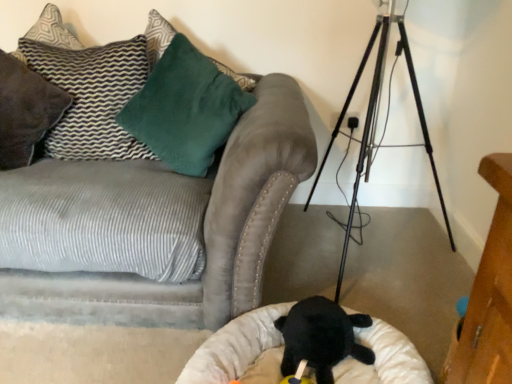
Question: Considering the relative sizes of metallic tripod at center and suede gray couch at upper left in the image provided, is metallic tripod at center wider than suede gray couch at upper left?

Choices:
 (A) yes
 (B) no

Answer: (B)

Question: Considering the relative positions of metallic tripod at center and suede gray couch at upper left in the image provided, is metallic tripod at center to the right of suede gray couch at upper left from the viewer's perspective?

Choices:
 (A) yes
 (B) no

Answer: (A)

Question: Is metallic tripod at center next to suede gray couch at upper left and touching it?

Choices:
 (A) no
 (B) yes

Answer: (A)

Question: Is metallic tripod at center oriented away from suede gray couch at upper left?

Choices:
 (A) no
 (B) yes

Answer: (A)

Question: Is metallic tripod at center far from suede gray couch at upper left?

Choices:
 (A) yes
 (B) no

Answer: (B)

Question: From a real-world perspective, does metallic tripod at center stand above suede gray couch at upper left?

Choices:
 (A) no
 (B) yes

Answer: (B)

Question: From a real-world perspective, is soft plush toy at center over black plush toy at lower center?

Choices:
 (A) yes
 (B) no

Answer: (B)

Question: Considering the relative positions of soft plush toy at center and black plush toy at lower center in the image provided, is soft plush toy at center behind black plush toy at lower center?

Choices:
 (A) yes
 (B) no

Answer: (A)

Question: Is soft plush toy at center wider than black plush toy at lower center?

Choices:
 (A) no
 (B) yes

Answer: (A)

Question: Can you confirm if soft plush toy at center is positioned to the left of black plush toy at lower center?

Choices:
 (A) no
 (B) yes

Answer: (B)

Question: Considering the relative positions of soft plush toy at center and black plush toy at lower center in the image provided, is soft plush toy at center to the right of black plush toy at lower center from the viewer's perspective?

Choices:
 (A) yes
 (B) no

Answer: (B)

Question: Is soft plush toy at center outside of black plush toy at lower center?

Choices:
 (A) yes
 (B) no

Answer: (A)

Question: From a real-world perspective, does white plush cat bed at lower center stand above velvety green pillow at upper left, arranged as the 1th pillow when viewed from the right?

Choices:
 (A) no
 (B) yes

Answer: (A)